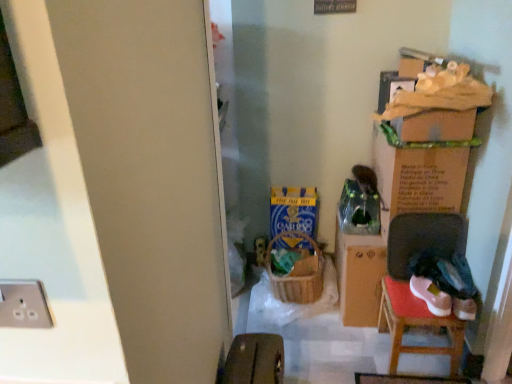
Question: From a real-world perspective, is cardboard box at upper right, which is the second cardboard box in left-to-right order, positioned over silver metallic socket at lower left based on gravity?

Choices:
 (A) yes
 (B) no

Answer: (B)

Question: Does cardboard box at upper right, the first cardboard box viewed from the right, appear on the left side of silver metallic socket at lower left?

Choices:
 (A) no
 (B) yes

Answer: (A)

Question: Is cardboard box at upper right, the first cardboard box viewed from the right, oriented away from silver metallic socket at lower left?

Choices:
 (A) yes
 (B) no

Answer: (B)

Question: Considering the relative sizes of cardboard box at upper right, which is the second cardboard box in left-to-right order, and silver metallic socket at lower left in the image provided, is cardboard box at upper right, which is the second cardboard box in left-to-right order, taller than silver metallic socket at lower left?

Choices:
 (A) no
 (B) yes

Answer: (B)

Question: Is cardboard box at upper right, which is the second cardboard box in left-to-right order, located outside silver metallic socket at lower left?

Choices:
 (A) no
 (B) yes

Answer: (B)

Question: Considering the positions of point (448, 180) and point (450, 243), is point (448, 180) closer or farther from the camera than point (450, 243)?

Choices:
 (A) farther
 (B) closer

Answer: (B)

Question: Is cardboard box at upper right, which is the second cardboard box in left-to-right order, wider or thinner than wooden chair at lower right?

Choices:
 (A) thin
 (B) wide

Answer: (B)

Question: Based on their positions, is cardboard box at upper right, the first cardboard box viewed from the right, located to the left or right of wooden chair at lower right?

Choices:
 (A) left
 (B) right

Answer: (B)

Question: Considering the positions of cardboard box at upper right, which is the second cardboard box in left-to-right order, and wooden chair at lower right in the image, is cardboard box at upper right, which is the second cardboard box in left-to-right order, bigger or smaller than wooden chair at lower right?

Choices:
 (A) small
 (B) big

Answer: (B)

Question: Is point (429, 238) positioned closer to the camera than point (379, 135)?

Choices:
 (A) closer
 (B) farther

Answer: (B)

Question: In the image, is wooden chair at lower right positioned in front of or behind cardboard box at upper right, the first cardboard box viewed from the right?

Choices:
 (A) behind
 (B) front

Answer: (B)

Question: In terms of width, does wooden chair at lower right look wider or thinner when compared to cardboard box at upper right, the first cardboard box viewed from the right?

Choices:
 (A) wide
 (B) thin

Answer: (B)

Question: From a real-world perspective, is wooden chair at lower right above or below cardboard box at upper right, which is the second cardboard box in left-to-right order?

Choices:
 (A) below
 (B) above

Answer: (A)

Question: Relative to silver metallic socket at lower left, is blue cardboard box at center, marked as the 2th cardboard box in a right-to-left arrangement, in front or behind?

Choices:
 (A) front
 (B) behind

Answer: (B)

Question: Does point (289, 216) appear closer or farther from the camera than point (31, 307)?

Choices:
 (A) closer
 (B) farther

Answer: (B)